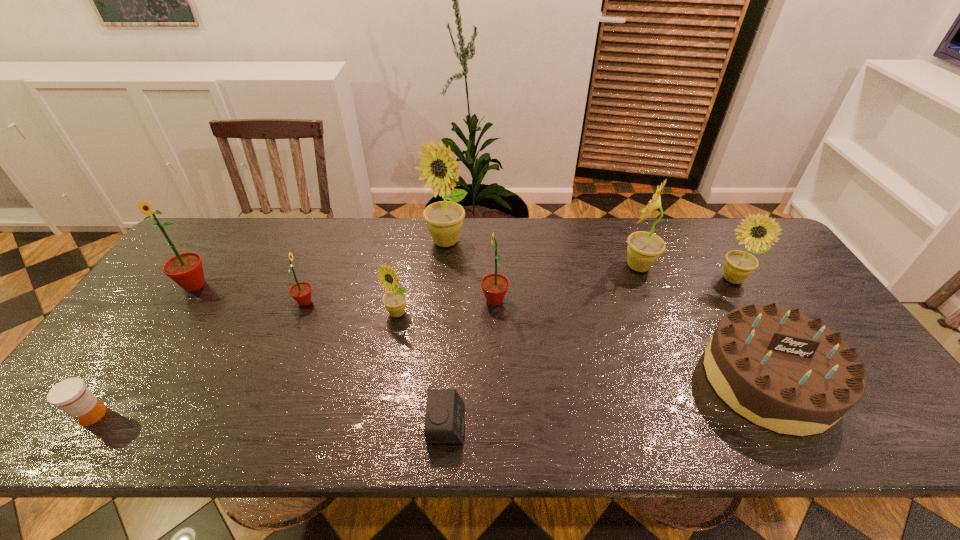
Select which green sunflower is the closest to the tallest sunflower. Please provide its 2D coordinates. Your answer should be formatted as a tuple, i.e. [(x, y)], where the tuple contains the x and y coordinates of a point satisfying the conditions above.

[(494, 286)]

In order to click on vacant space that satisfies the following two spatial constraints: 1. on the face of the rightmost sunflower; 2. on the label of the medicine in this screenshot , I will do `click(814, 415)`.

This screenshot has width=960, height=540. I want to click on free location that satisfies the following two spatial constraints: 1. on the face of the second sunflower from right to left; 2. on the face of the nearest yellow sunflower, so click(x=657, y=313).

Where is `free spot that satisfies the following two spatial constraints: 1. on the face of the second biggest yellow sunflower; 2. on the face of the biggest green sunflower`? This screenshot has width=960, height=540. free spot that satisfies the following two spatial constraints: 1. on the face of the second biggest yellow sunflower; 2. on the face of the biggest green sunflower is located at coordinates (645, 285).

Locate an element on the screen. This screenshot has height=540, width=960. free space that satisfies the following two spatial constraints: 1. on the front-facing side of the brown birthday cake; 2. on the label of the orange medicine is located at coordinates (788, 415).

You are a GUI agent. You are given a task and a screenshot of the screen. Output one action in this format:
    pyautogui.click(x=<x>, y=<y>)
    Task: Click on the vacant area that satisfies the following two spatial constraints: 1. on the face of the rightmost sunflower; 2. on the front-facing side of the black alarm clock
    This screenshot has height=540, width=960.
    Given the screenshot: What is the action you would take?
    pyautogui.click(x=820, y=424)

What are the coordinates of `vacant space that satisfies the following two spatial constraints: 1. on the front-facing side of the eighth tallest object; 2. on the front-facing side of the alarm clock` in the screenshot? It's located at (793, 424).